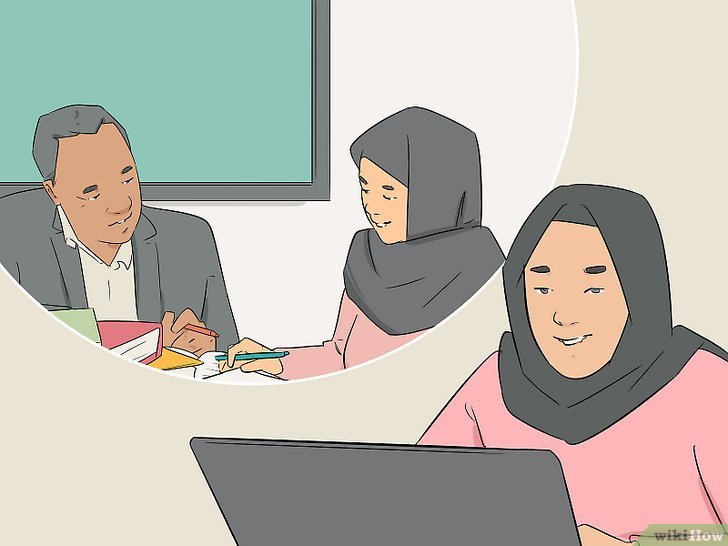
Find the location of `gray frame`. gray frame is located at coordinates (325, 115).